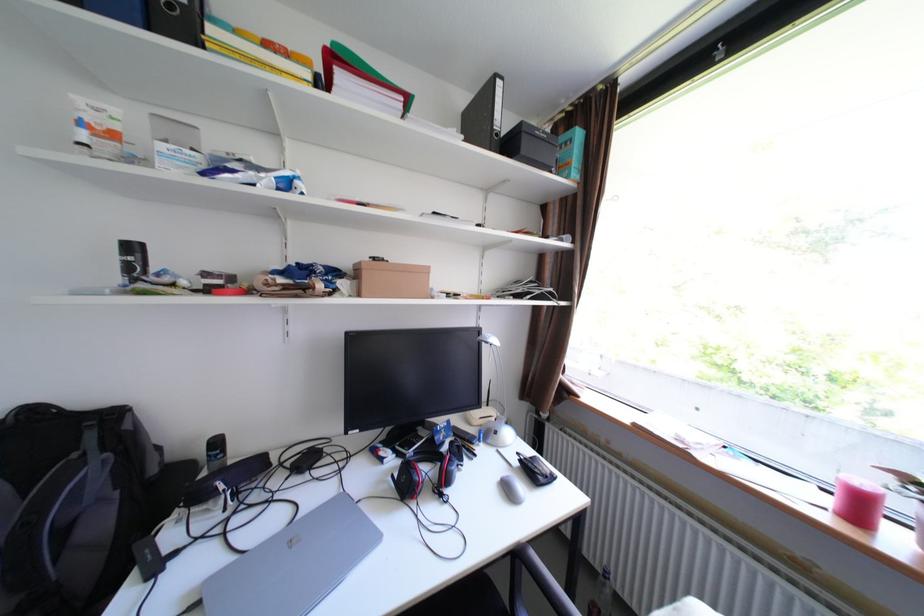
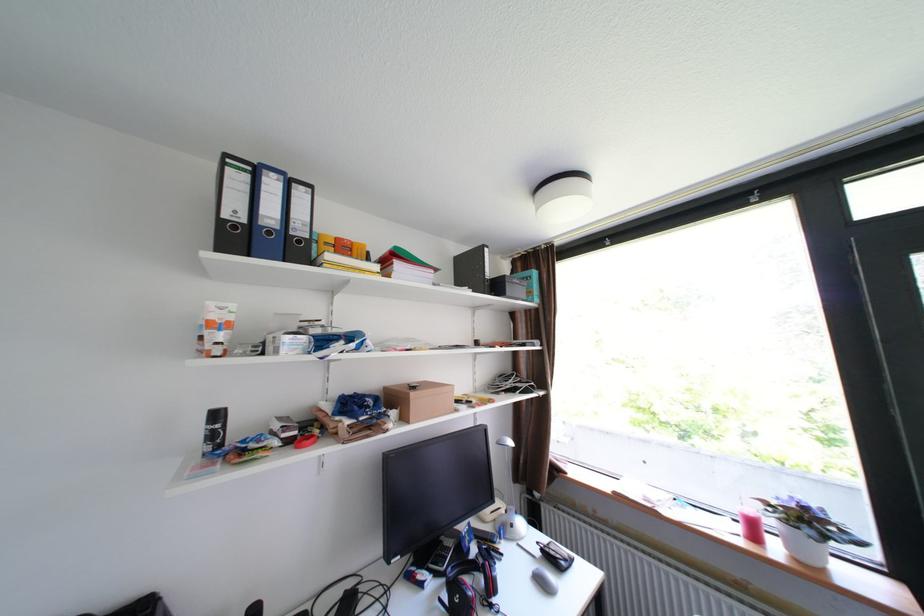
The point at (x=517, y=490) is marked in the first image. Where is the corresponding point in the second image?

(552, 583)